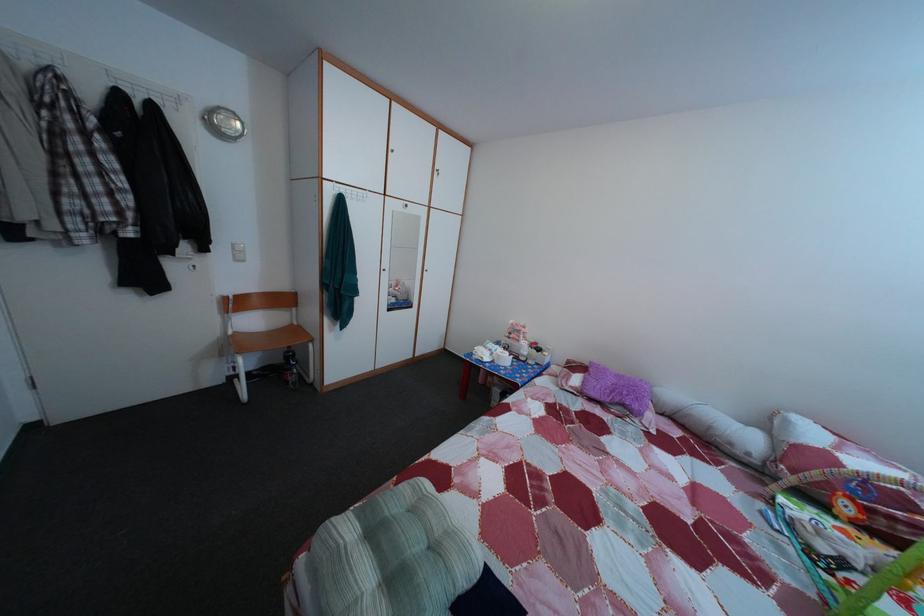
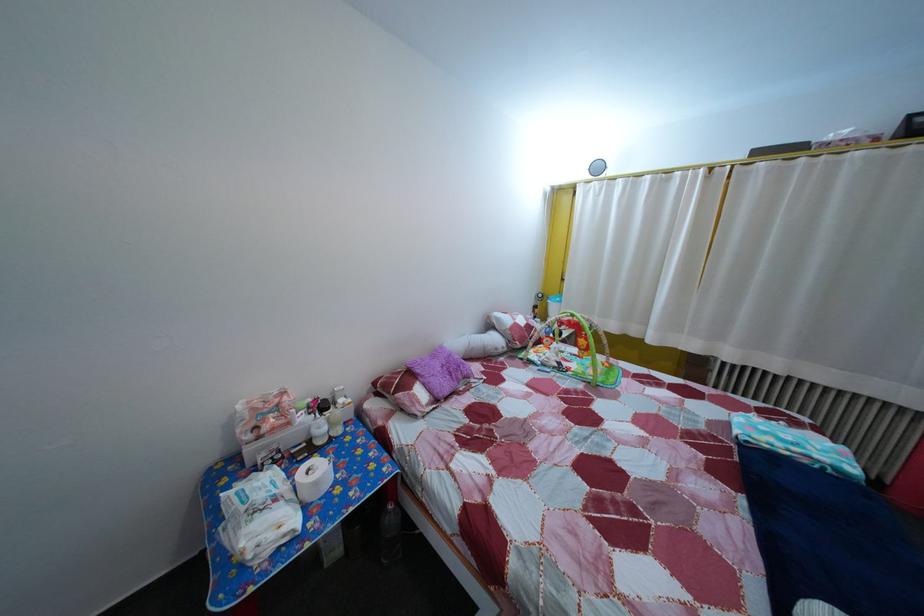
Where in the second image is the point corresponding to pixel 833 557 from the first image?

(565, 371)